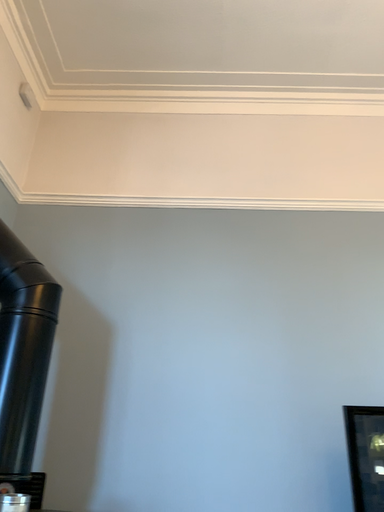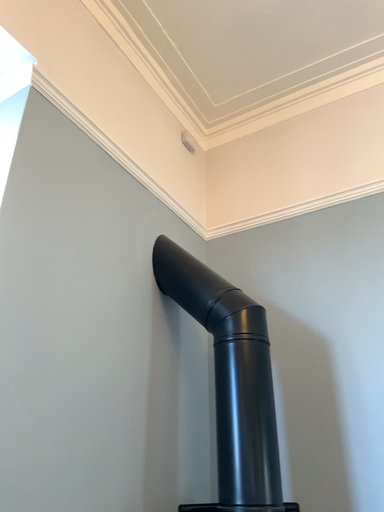
Question: Which way did the camera rotate in the video?

Choices:
 (A) rotated right
 (B) rotated left

Answer: (B)